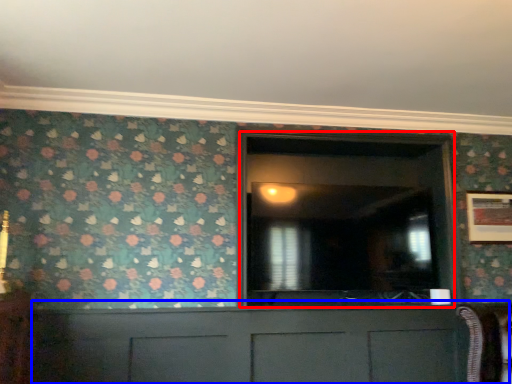
Question: Among these objects, which one is farthest to the camera, glass door (highlighted by a red box) or cabinetry (highlighted by a blue box)?

Choices:
 (A) glass door
 (B) cabinetry

Answer: (A)